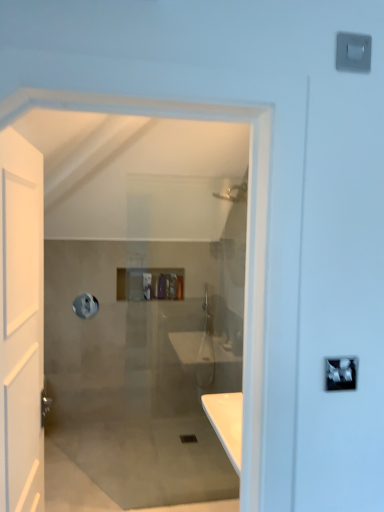
Question: Is silver metallic lock at upper right positioned far away from translucent plastic toiletries at center?

Choices:
 (A) yes
 (B) no

Answer: (A)

Question: From a real-world perspective, is silver metallic lock at upper right located higher than translucent plastic toiletries at center?

Choices:
 (A) no
 (B) yes

Answer: (B)

Question: Is silver metallic lock at upper right taller than translucent plastic toiletries at center?

Choices:
 (A) no
 (B) yes

Answer: (A)

Question: Is silver metallic lock at upper right positioned with its back to translucent plastic toiletries at center?

Choices:
 (A) yes
 (B) no

Answer: (A)

Question: Could you tell me if silver metallic lock at upper right is turned towards translucent plastic toiletries at center?

Choices:
 (A) no
 (B) yes

Answer: (A)

Question: From the image's perspective, is translucent plastic toiletries at center above or below white matte door at left?

Choices:
 (A) above
 (B) below

Answer: (A)

Question: Is point (168, 282) positioned closer to the camera than point (41, 503)?

Choices:
 (A) farther
 (B) closer

Answer: (A)

Question: Based on their positions, is translucent plastic toiletries at center located to the left or right of white matte door at left?

Choices:
 (A) right
 (B) left

Answer: (A)

Question: In terms of size, does translucent plastic toiletries at center appear bigger or smaller than white matte door at left?

Choices:
 (A) big
 (B) small

Answer: (B)

Question: Is translucent plastic toiletries at center taller or shorter than silver metallic towel bar at upper left?

Choices:
 (A) short
 (B) tall

Answer: (A)

Question: Is translucent plastic toiletries at center bigger or smaller than silver metallic towel bar at upper left?

Choices:
 (A) small
 (B) big

Answer: (B)

Question: From a real-world perspective, is translucent plastic toiletries at center positioned above or below silver metallic towel bar at upper left?

Choices:
 (A) above
 (B) below

Answer: (A)

Question: In terms of width, does translucent plastic toiletries at center look wider or thinner when compared to silver metallic towel bar at upper left?

Choices:
 (A) thin
 (B) wide

Answer: (B)

Question: Considering the positions of white matte door at left and translucent plastic toiletries at center in the image, is white matte door at left wider or thinner than translucent plastic toiletries at center?

Choices:
 (A) thin
 (B) wide

Answer: (B)

Question: From the image's perspective, is white matte door at left located above or below translucent plastic toiletries at center?

Choices:
 (A) below
 (B) above

Answer: (A)